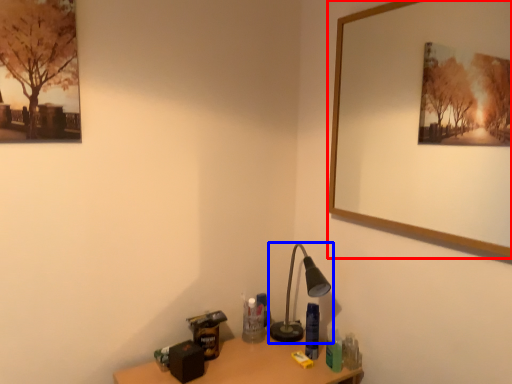
Question: Which object is further to the camera taking this photo, picture frame (highlighted by a red box) or lamp (highlighted by a blue box)?

Choices:
 (A) picture frame
 (B) lamp

Answer: (B)